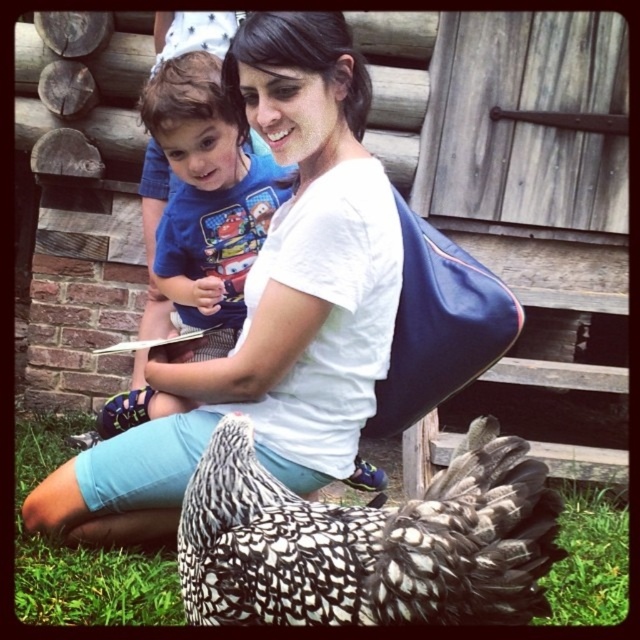
You are a photographer trying to capture a photo of the two shirts in the image. The white matte shirt at center and the blue cotton shirt at center are both in your viewfinder. According to the scene, which shirt is positioned to the right side of the other?

The white matte shirt at center is positioned to the right of the blue cotton shirt at center.

You are a photographer trying to capture a photo of the black and white speckled feathered chicken at lower center and the blue cotton shirt at center. The minimum focus distance of your camera is 30 inches. Will you be able to focus on both subjects clearly?

The distance between the black and white speckled feathered chicken at lower center and the blue cotton shirt at center is 35.29 inches, which is greater than the camera minimum focus distance of 30 inches. Therefore, the camera can focus on both subjects clearly.